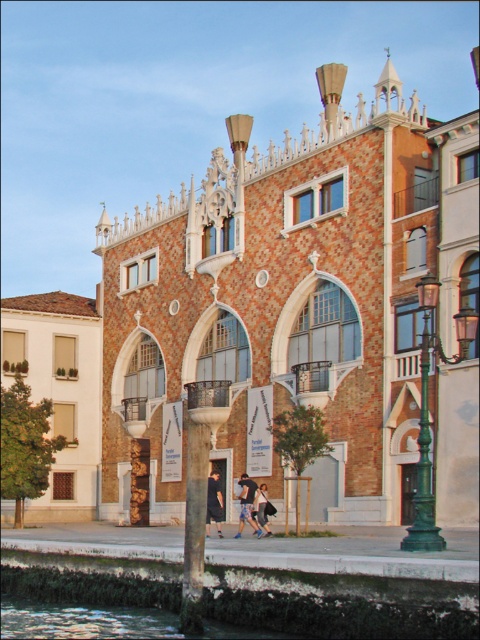
Question: Which object appears closest to the camera in this image?

Choices:
 (A) green metal lamp post at lower right
 (B) dark blue fabric at center
 (C) denim pants at lower center

Answer: (A)

Question: Is green metal lamp post at lower right in front of dark blue fabric at center?

Choices:
 (A) yes
 (B) no

Answer: (A)

Question: Is green metal lamp post at lower right to the right of dark blue fabric at center from the viewer's perspective?

Choices:
 (A) no
 (B) yes

Answer: (B)

Question: Is dark gray fabric pants at center above dark blue fabric at center?

Choices:
 (A) no
 (B) yes

Answer: (B)

Question: Considering the real-world distances, which object is farthest from the green metal lamp post at lower right?

Choices:
 (A) denim pants at lower center
 (B) dark blue fabric at center
 (C) dark gray fabric pants at center

Answer: (A)

Question: Which object is positioned closest to the denim pants at lower center?

Choices:
 (A) dark gray fabric pants at center
 (B) dark blue fabric at center

Answer: (B)